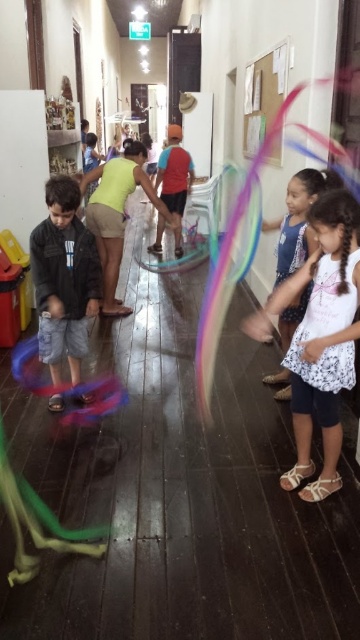
Which is below, matte black jacket at left or matte red shirt at center?

matte black jacket at left is lower down.

Does matte black jacket at left appear on the right side of matte red shirt at center?

Incorrect, matte black jacket at left is not on the right side of matte red shirt at center.

Identify the location of matte black jacket at left. (64, 278).

The image size is (360, 640). I want to click on matte black jacket at left, so click(64, 278).

Looking at this image, which is above, light green fabric shirt at center or matte red shirt at center?

matte red shirt at center

Who is more distant from viewer, (133, 150) or (164, 196)?

Positioned behind is point (164, 196).

Is point (150, 182) positioned before point (173, 131)?

That is True.

Where is `light green fabric shirt at center`? light green fabric shirt at center is located at coordinates (117, 216).

Is point (285, 369) positioned behind point (182, 168)?

No.

Between white printed dress at center and matte red shirt at center, which one appears on the left side from the viewer's perspective?

matte red shirt at center is more to the left.

Is point (321, 179) less distant than point (169, 163)?

Yes, point (321, 179) is in front of point (169, 163).

At what (x,y) coordinates should I click in order to perform the action: click on white printed dress at center. Please return your answer as a coordinate pair (x, y). The image size is (360, 640). Looking at the image, I should click on (299, 220).